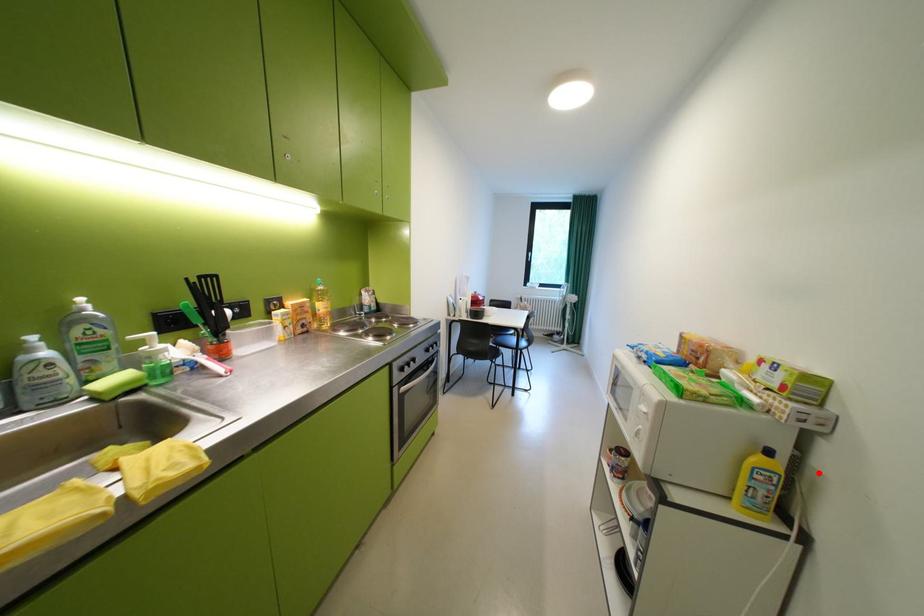
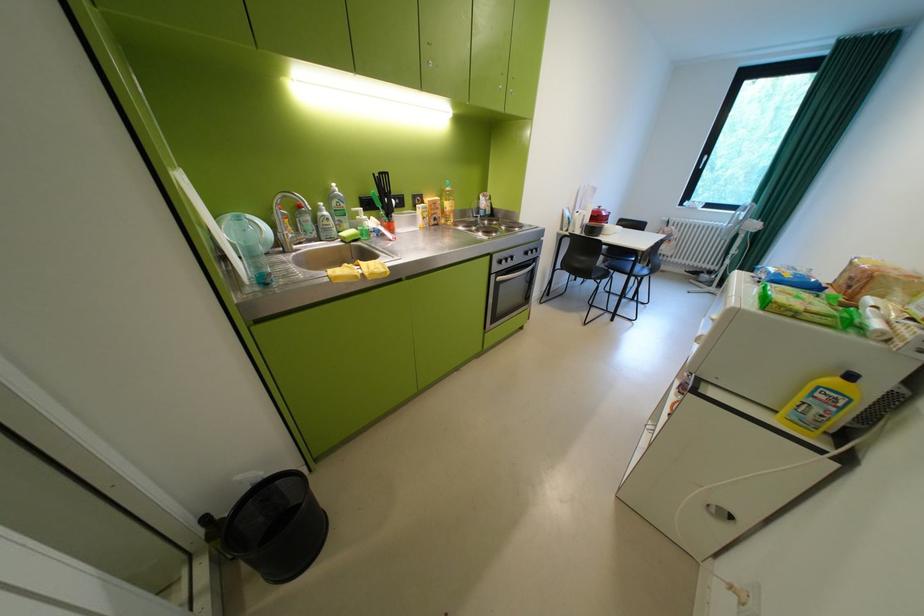
Question: I am providing you with two images of the same scene from different viewpoints. A red point is marked on the first image. At the location where the point appears in image 1, is it still visible in image 2?

Choices:
 (A) Yes
 (B) No

Answer: (A)